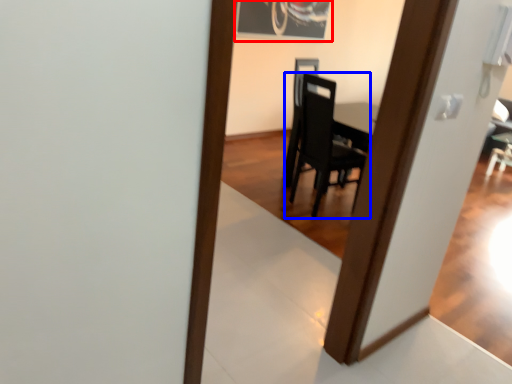
Question: Which point is closer to the camera, picture frame (highlighted by a red box) or chair (highlighted by a blue box)?

Choices:
 (A) picture frame
 (B) chair

Answer: (B)